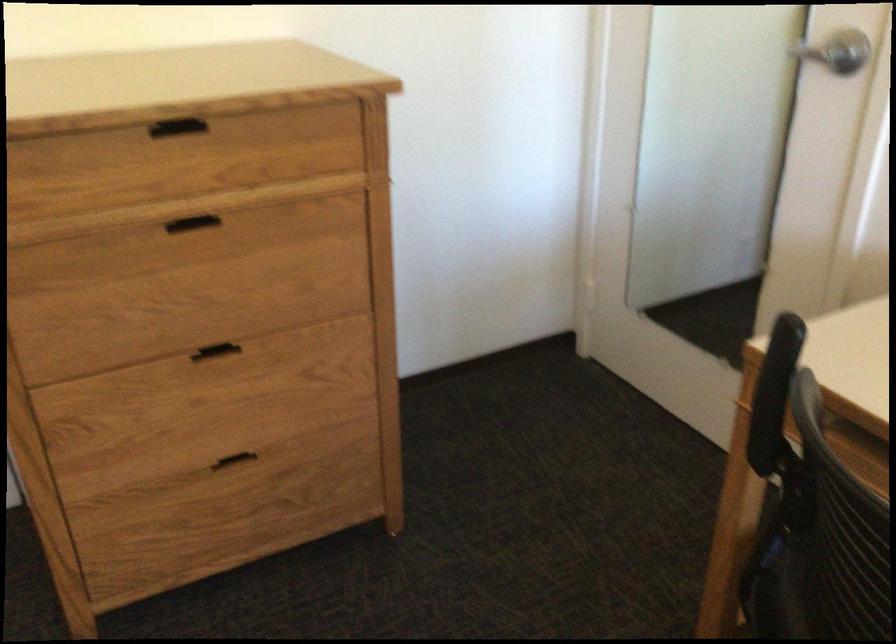
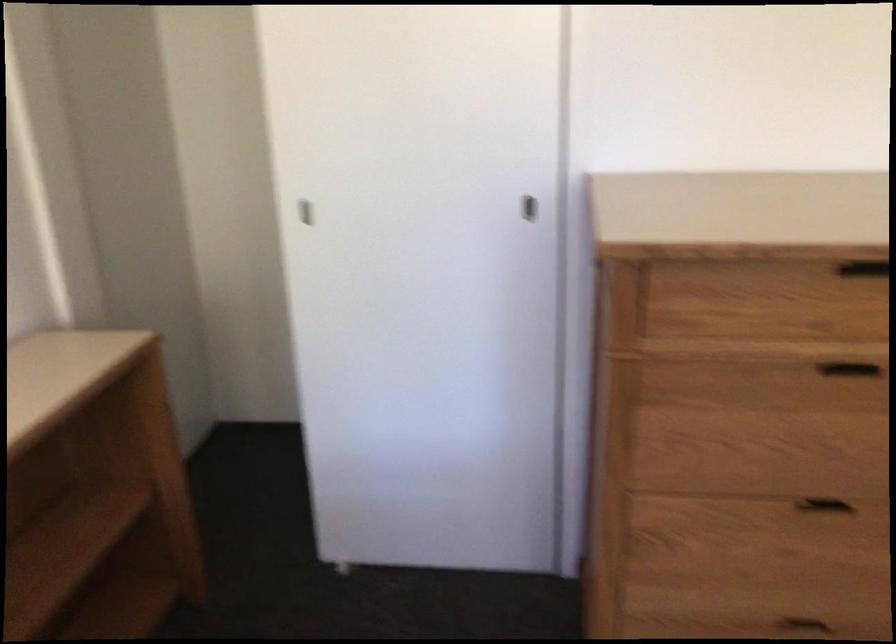
Question: The camera is either moving clockwise (left) or counter-clockwise (right) around the object. The first image is from the beginning of the video and the second image is from the end. Is the camera moving left or right when shooting the video?

Choices:
 (A) Left
 (B) Right

Answer: (B)